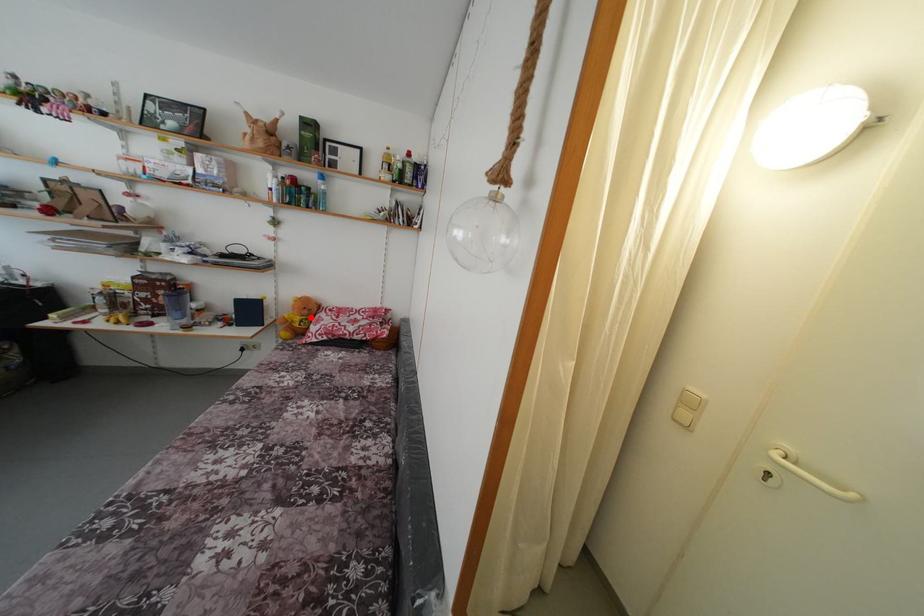
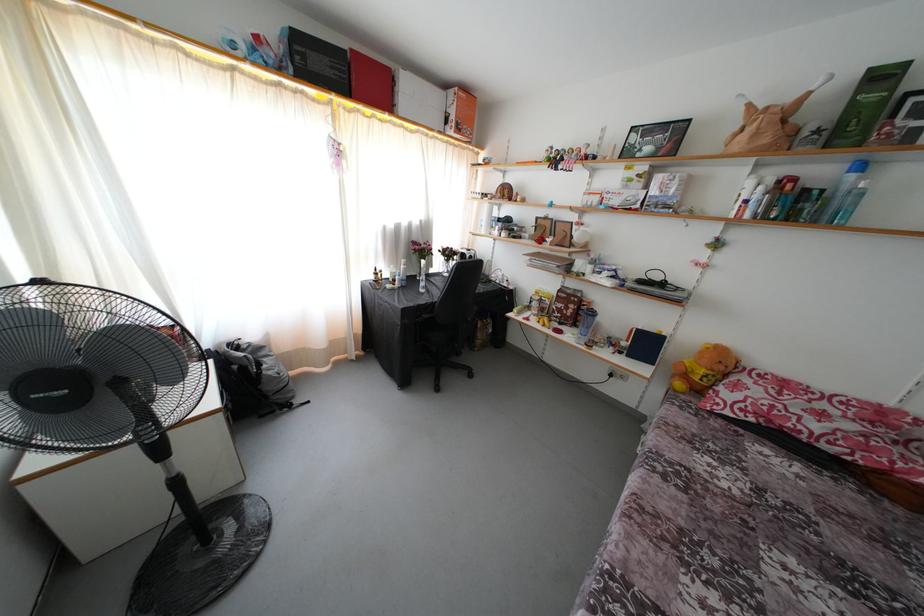
Where in the second image is the point corresponding to the highlighted location from the first image?

(726, 373)